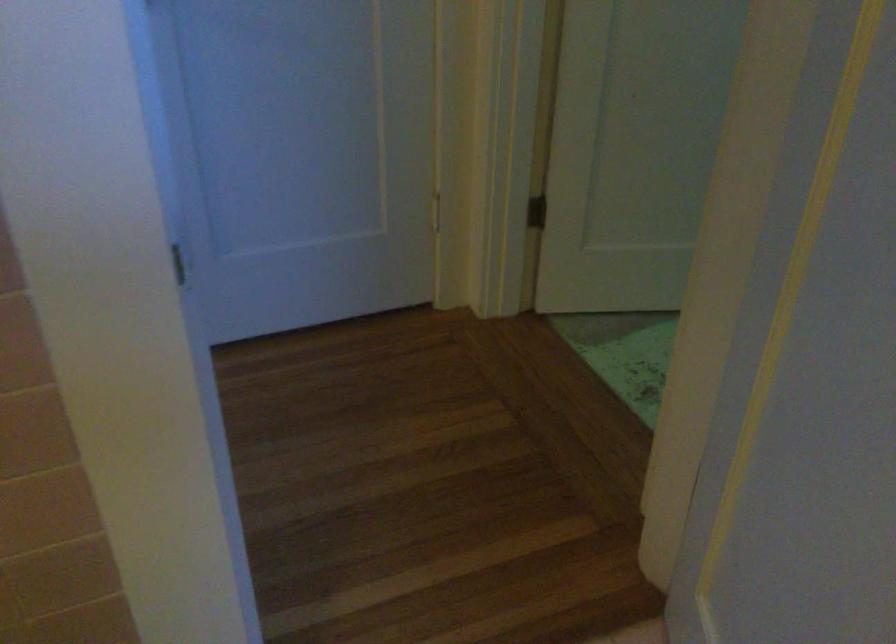
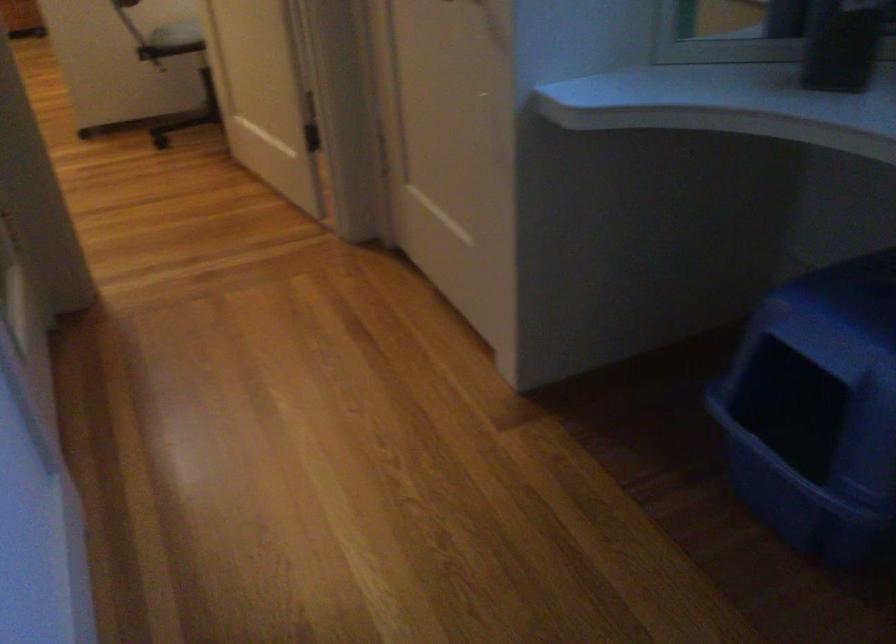
Based on the photo, based on the continuous images, in which direction is the camera rotating?

The rotation direction of the camera is left-down.